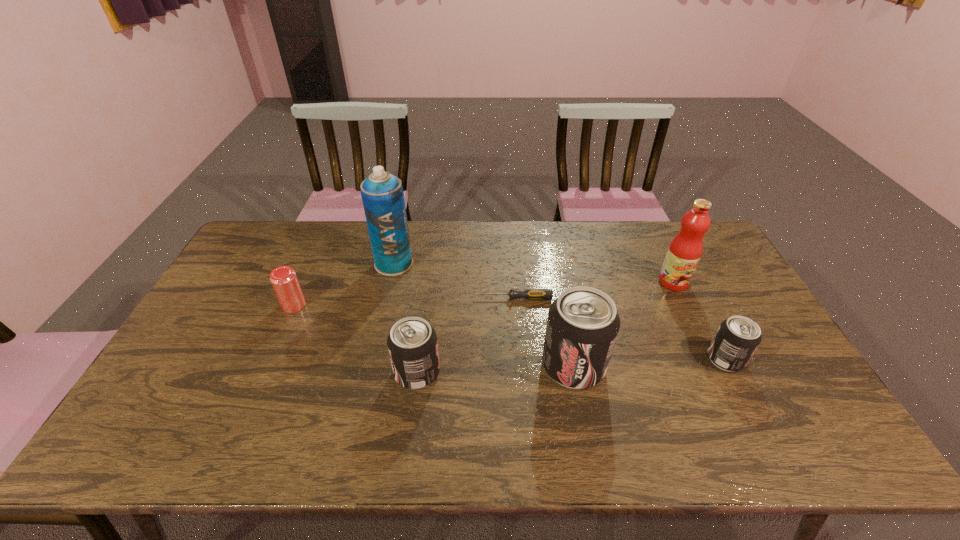
This screenshot has width=960, height=540. I want to click on fruit juice present at the right edge, so click(685, 250).

Identify the location of blank space at the far edge of the desktop. (643, 262).

Where is `free space at the near edge of the desktop`? The image size is (960, 540). free space at the near edge of the desktop is located at coordinates [663, 387].

This screenshot has height=540, width=960. I want to click on vacant space at the left edge of the desktop, so coord(199,353).

Where is `free space at the right edge of the desktop`? free space at the right edge of the desktop is located at coordinates (695, 295).

Locate an element on the screen. This screenshot has height=540, width=960. vacant point at the near left corner is located at coordinates (188, 389).

Identify the location of free point between the screwdriver and the aerosol can. This screenshot has width=960, height=540. (453, 281).

Where is `free point between the tallest soda can and the second tallest soda can`? The image size is (960, 540). free point between the tallest soda can and the second tallest soda can is located at coordinates (495, 369).

What are the coordinates of `free space between the third tallest object and the tallest object` in the screenshot? It's located at (484, 315).

You are a GUI agent. You are given a task and a screenshot of the screen. Output one action in this format:
    pyautogui.click(x=<x>, y=<y>)
    Task: Click on the free space that is in between the fruit juice and the rightmost soda can
    This screenshot has height=540, width=960.
    Given the screenshot: What is the action you would take?
    pyautogui.click(x=700, y=320)